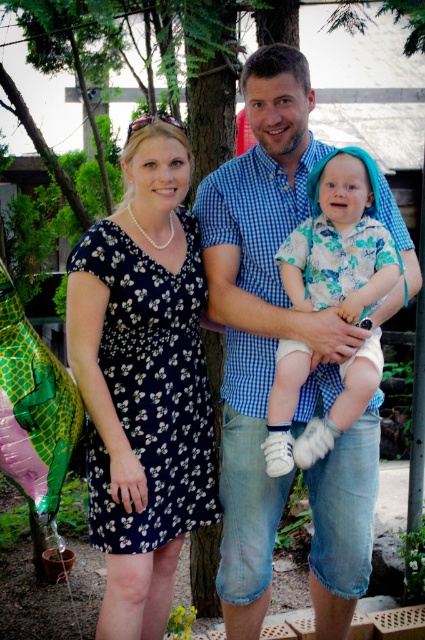
Question: Which object is farther from the camera taking this photo?

Choices:
 (A) floral fabric shirt at center
 (B) blue checkered shirt at center

Answer: (B)

Question: Is blue checkered shirt at center wider than black floral dress at left?

Choices:
 (A) no
 (B) yes

Answer: (B)

Question: Is blue checkered shirt at center positioned in front of black floral dress at left?

Choices:
 (A) yes
 (B) no

Answer: (B)

Question: Which of the following is the closest to the observer?

Choices:
 (A) blue checkered shirt at center
 (B) floral fabric shirt at center
 (C) black floral dress at left

Answer: (B)

Question: Which point appears farthest from the camera in this image?

Choices:
 (A) (180, 340)
 (B) (272, 392)

Answer: (A)

Question: Does blue checkered shirt at center have a smaller size compared to black floral dress at left?

Choices:
 (A) no
 (B) yes

Answer: (A)